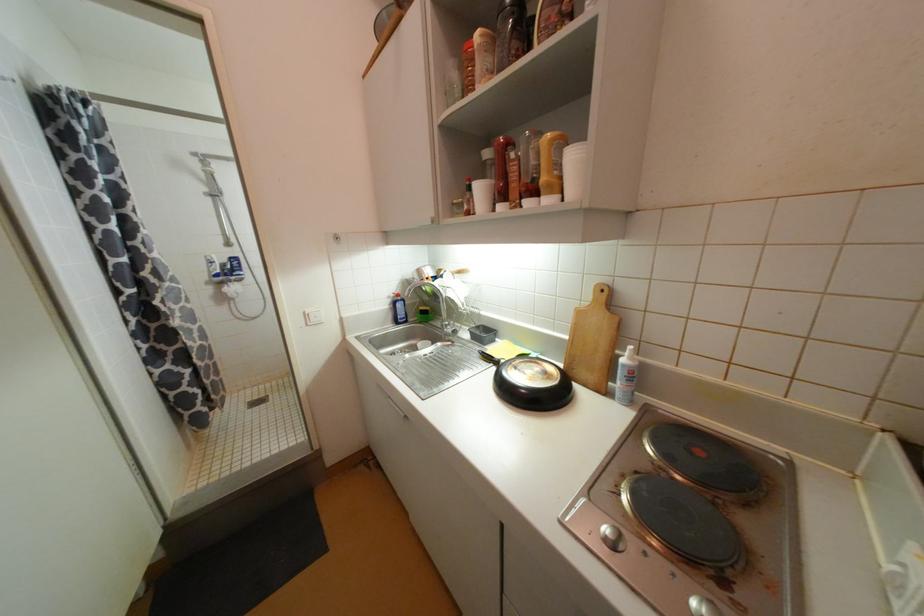
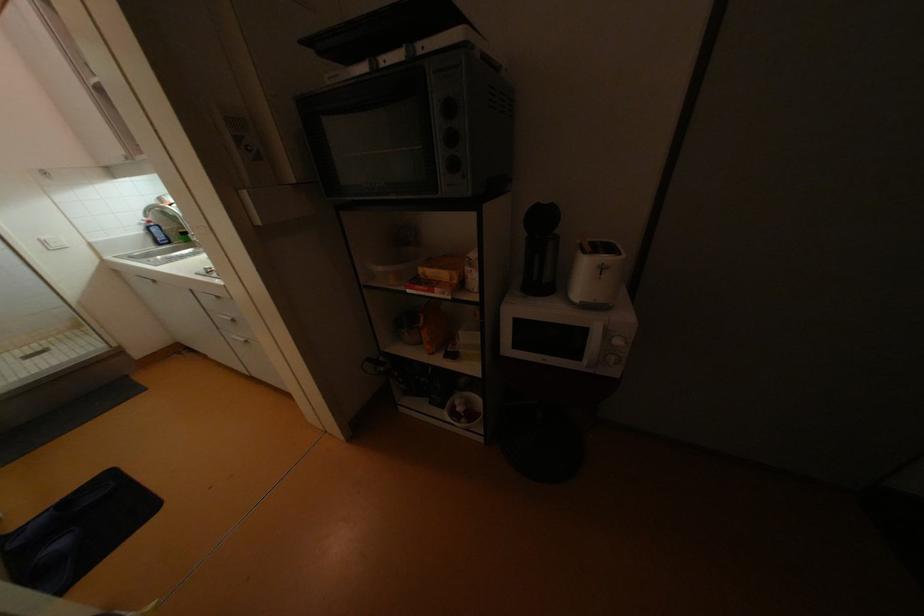
Where in the second image is the point corresponding to [310,317] from the first image?

(49, 243)